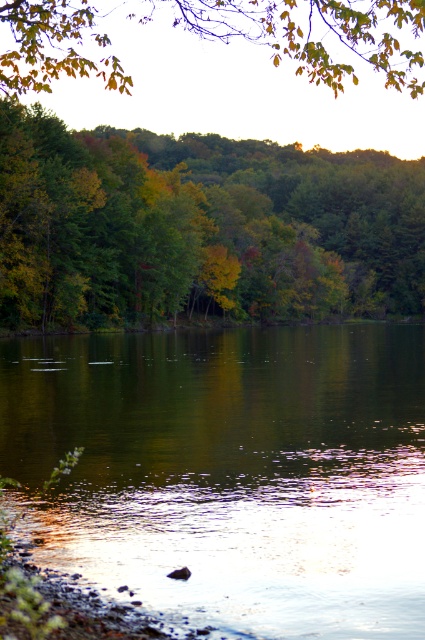
Question: In this image, where is green reflective water at center located relative to green leafy tree at upper left?

Choices:
 (A) above
 (B) below

Answer: (B)

Question: Among these points, which one is nearest to the camera?

Choices:
 (A) (300, 225)
 (B) (42, 68)
 (C) (309, 488)

Answer: (C)

Question: Among these points, which one is nearest to the camera?

Choices:
 (A) (27, 316)
 (B) (294, 58)

Answer: (A)

Question: Among these points, which one is farthest from the camera?

Choices:
 (A) (17, 29)
 (B) (218, 147)
 (C) (317, 502)

Answer: (B)

Question: Is green reflective water at center bigger than green matte leaves at upper center?

Choices:
 (A) yes
 (B) no

Answer: (B)

Question: Is green reflective water at center wider than green leafy tree at upper left?

Choices:
 (A) no
 (B) yes

Answer: (A)